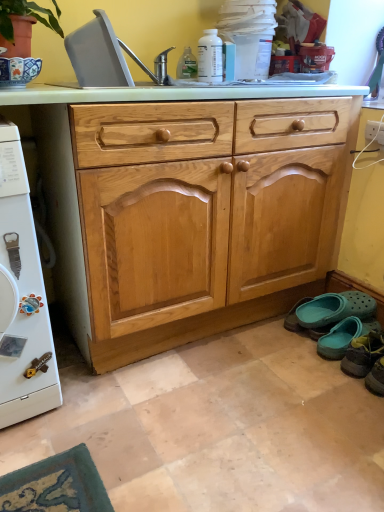
The image size is (384, 512). What are the coordinates of `blank space situated above teal rubber clogs at lower right, the first footwear from the back (from a real-world perspective)` in the screenshot? It's located at (328, 308).